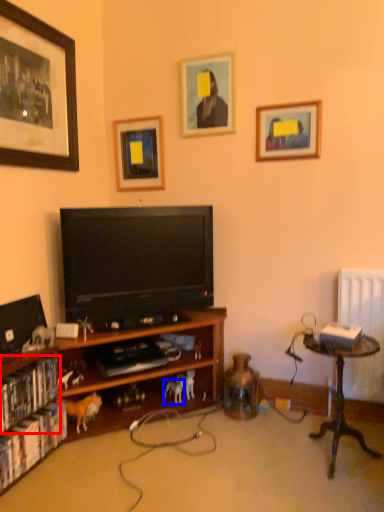
Question: Which object is closer to the camera taking this photo, book (highlighted by a red box) or animal (highlighted by a blue box)?

Choices:
 (A) book
 (B) animal

Answer: (A)